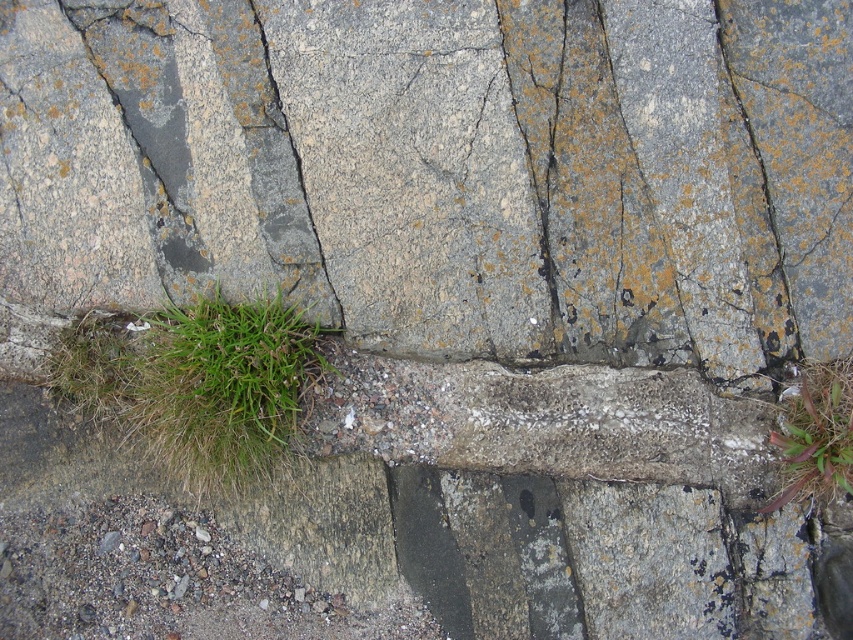
You are standing in front of a stone wall with weathered stones. There is a point marked at coordinates (445, 168). What object is located at this point?

The point at coordinates (445, 168) indicates a gray rough stone at center.

You are a gardener trying to remove weeds from the green grass at lower right. There is a gray rough stone at center in the way. Based on the scene, can you move the stone to access the grass?

The gray rough stone at center is positioned over the green grass at lower right, so you can move the stone to access the grass below.